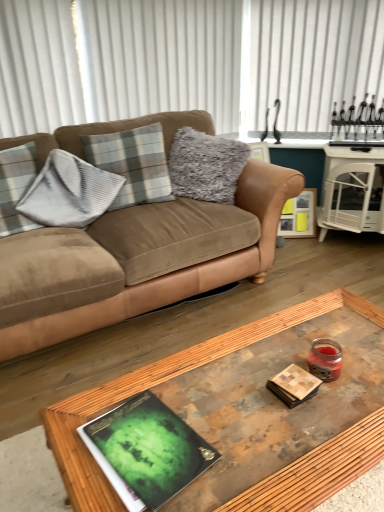
Where is `vacant space in front of wooden picture frame at right`? vacant space in front of wooden picture frame at right is located at coordinates (306, 244).